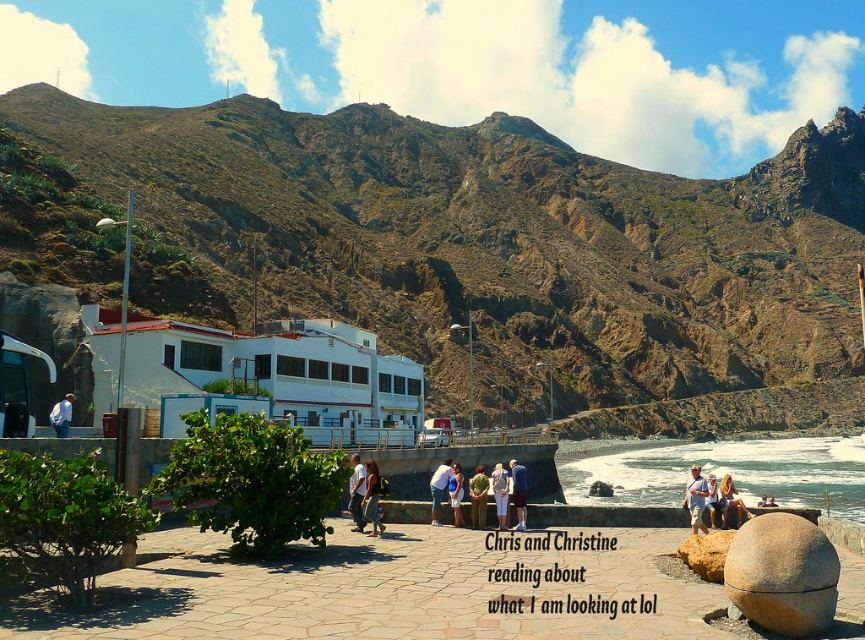
Question: Which of the following is the farthest from the observer?

Choices:
 (A) (863, 593)
 (B) (359, 474)
 (C) (272, 371)

Answer: (C)

Question: Is white matte building at center wider than light blue denim shorts at lower right?

Choices:
 (A) no
 (B) yes

Answer: (B)

Question: Is light blue denim shorts at lower right to the left of blonde hair at lower right from the viewer's perspective?

Choices:
 (A) yes
 (B) no

Answer: (B)

Question: Is white matte building at center bigger than matte white shirt at center?

Choices:
 (A) yes
 (B) no

Answer: (A)

Question: Which is nearer to the white shirt at center?

Choices:
 (A) brown rocky mountain at upper center
 (B) white matte building at center

Answer: (B)

Question: Which object is farther from the camera taking this photo?

Choices:
 (A) blue fabric shirt at center
 (B) denim shorts at center
 (C) blonde hair at lower right

Answer: (A)